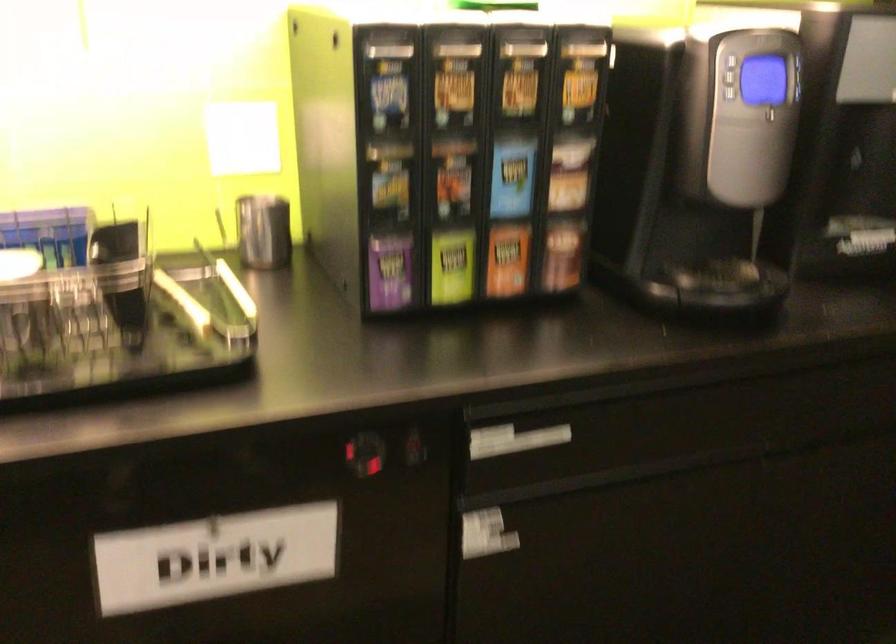
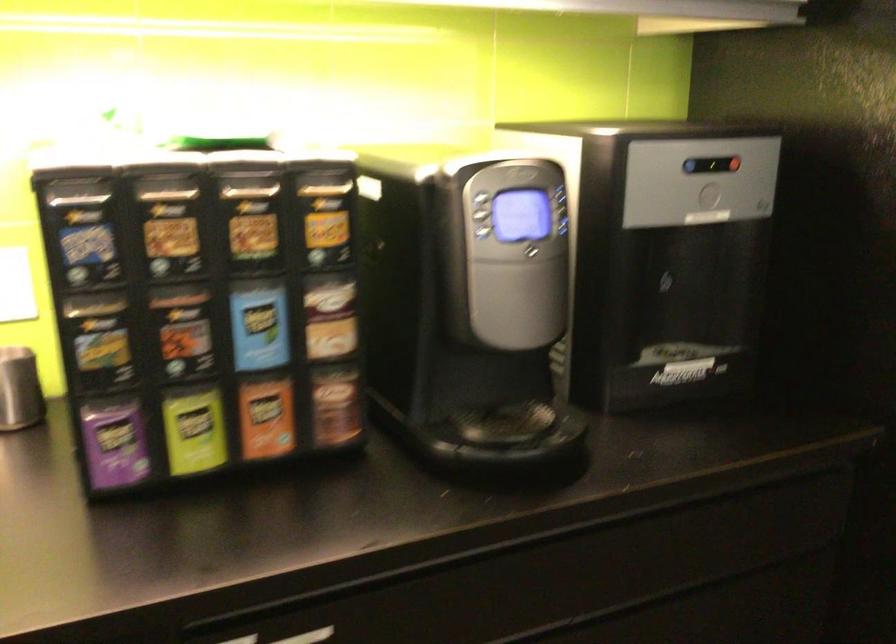
Find the pixel in the second image that matches [512,174] in the first image.

(259, 327)